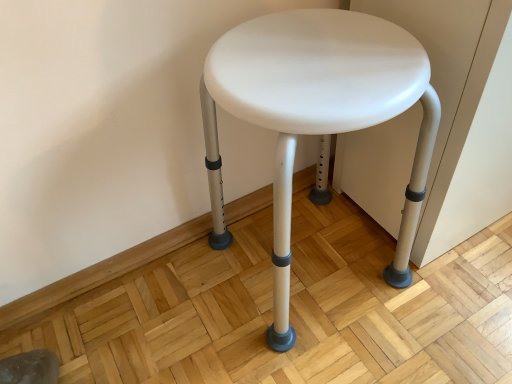
Where is `vacant area to the left of white plastic stool at center`? The height and width of the screenshot is (384, 512). vacant area to the left of white plastic stool at center is located at coordinates (173, 311).